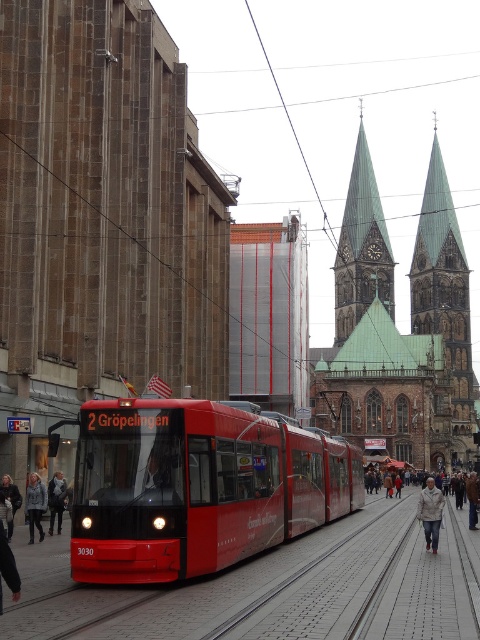
Who is more distant from viewer, [167,179] or [60,481]?

Positioned behind is point [167,179].

In the scene shown: Which is more to the right, brown stone church at center or light beige jacket at lower left?

brown stone church at center is more to the right.

Between point (135, 308) and point (60, 483), which one is positioned behind?

The point (135, 308) is behind.

Identify the location of brown stone church at center. click(x=101, y=218).

Can you confirm if green stone church at upper center is positioned above light beige jacket at center?

→ Indeed, green stone church at upper center is positioned over light beige jacket at center.

Who is more forward, (427,339) or (442,496)?

Point (442,496) is in front.

Measure the distance between point (437,221) and camera.

They are 511.75 feet apart.

Find the location of a particular element. green stone church at upper center is located at coordinates point(396,330).

The height and width of the screenshot is (640, 480). What do you see at coordinates (35, 506) in the screenshot?
I see `light gray fleece jacket at lower left` at bounding box center [35, 506].

What are the coordinates of `light gray fleece jacket at lower left` in the screenshot? It's located at (35, 506).

Where is `light gray fleece jacket at lower left`? This screenshot has width=480, height=640. light gray fleece jacket at lower left is located at coordinates (35, 506).